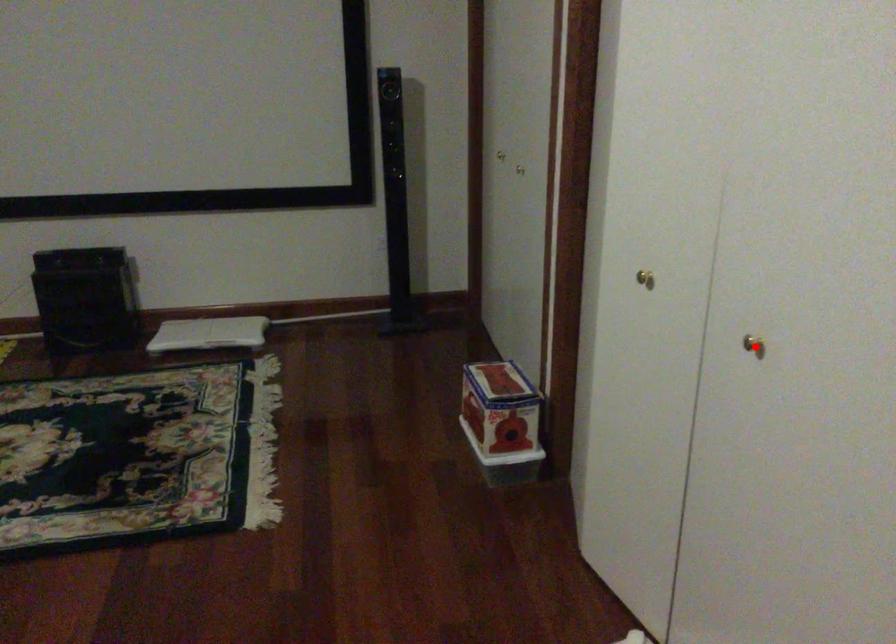
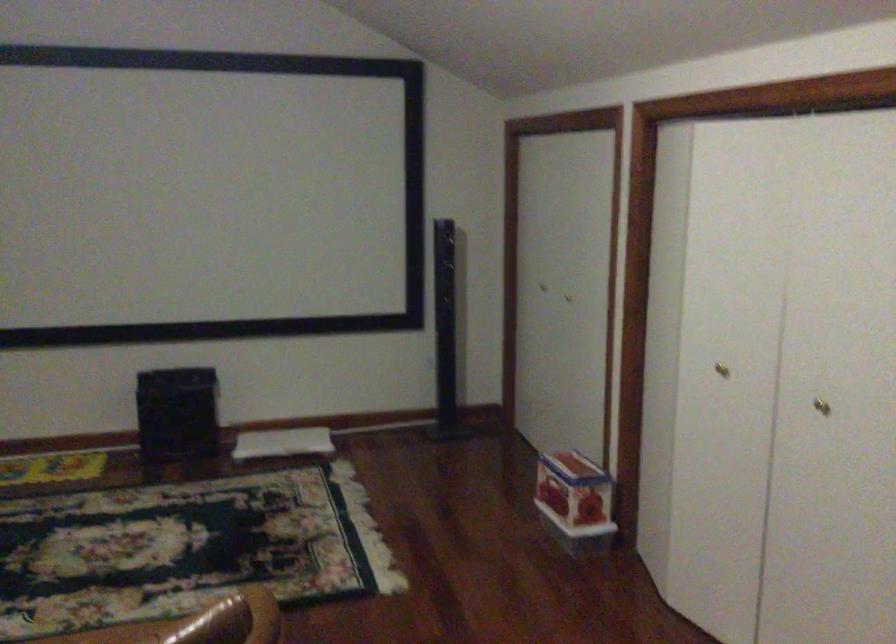
Locate, in the second image, the point that corresponds to the highlighted location in the first image.

(821, 406)